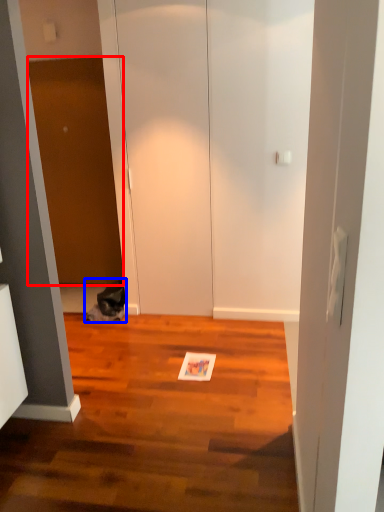
Question: Which object is closer to the camera taking this photo, door (highlighted by a red box) or cat (highlighted by a blue box)?

Choices:
 (A) door
 (B) cat

Answer: (B)